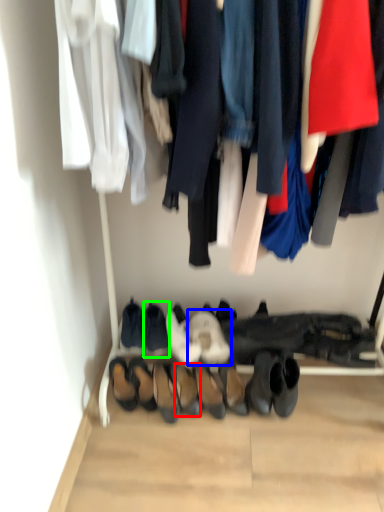
Question: Which object is the farthest from footwear (highlighted by a red box)? Choose among these: footwear (highlighted by a blue box) or footwear (highlighted by a green box).

Choices:
 (A) footwear
 (B) footwear

Answer: (B)